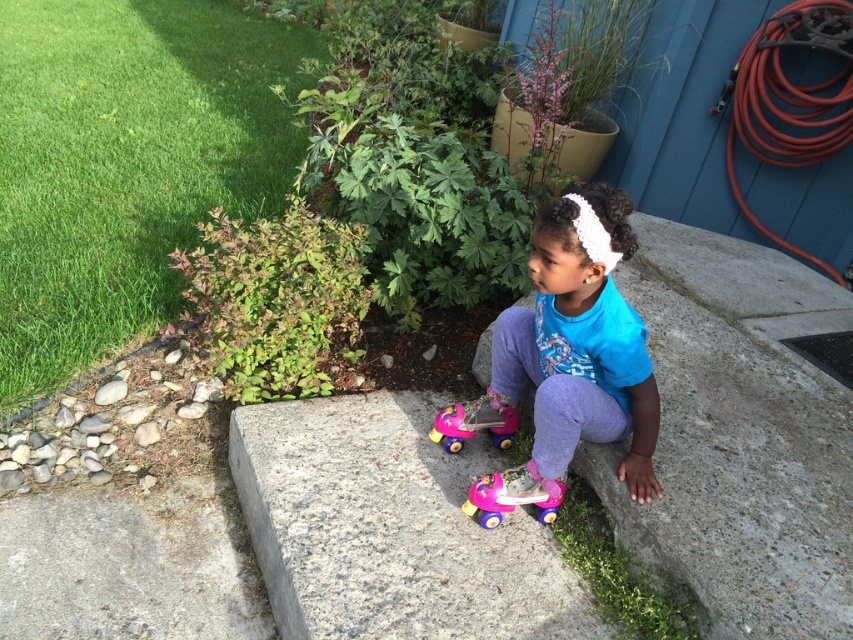
You are a fashion designer observing the child in the garden. You need to determine which item has a greater width between the blue matte shirt at center and the pink plastic walker at lower center. Which one is wider?

The blue matte shirt at center is wider than the pink plastic walker at lower center according to the description.

You are a photographer setting up a shot of the scene. You need to ensure that the gray granite concrete at center and the blue matte shirt at center are both in focus. Which object should you adjust your camera focus to prioritize for a wider depth of field?

The gray granite concrete at center should be prioritized for focus since it is wider than the blue matte shirt at center, allowing the camera to capture more of its details within the depth of field.

You are a parent looking for your child in a garden. You see a blue matte shirt at center and a pink plastic walker at lower center. Which object is located to the right of the other?

The blue matte shirt at center is positioned on the right side of pink plastic walker at lower center.